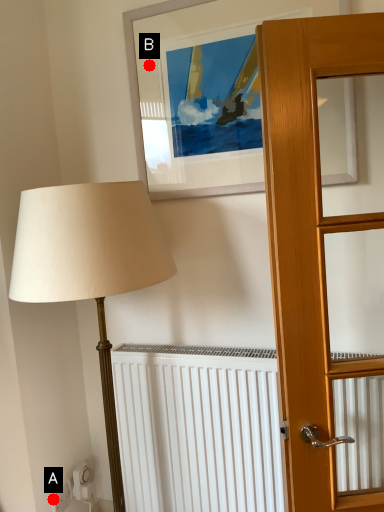
Question: Two points are circled on the image, labeled by A and B beside each circle. Which point appears farthest from the camera in this image?

Choices:
 (A) A is further
 (B) B is further

Answer: (A)